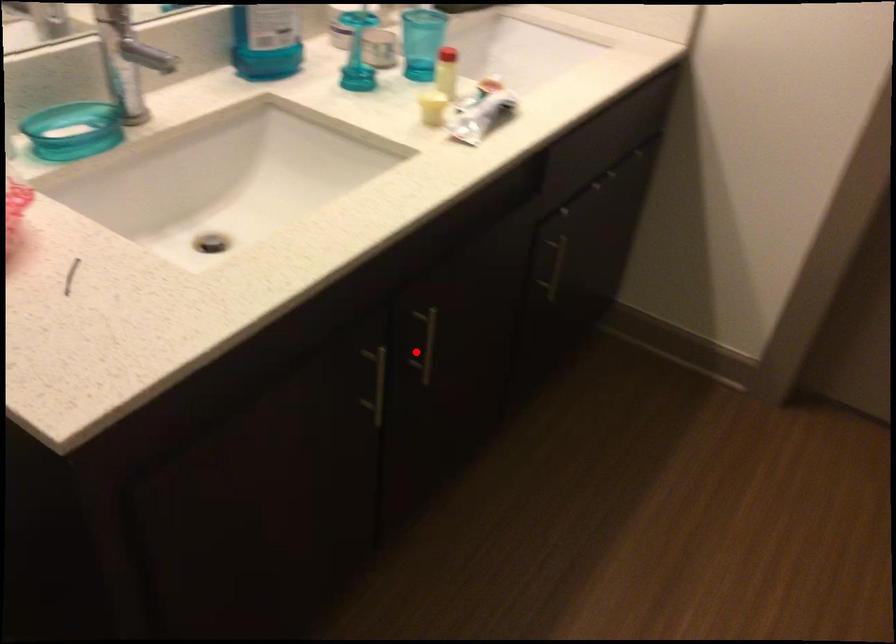
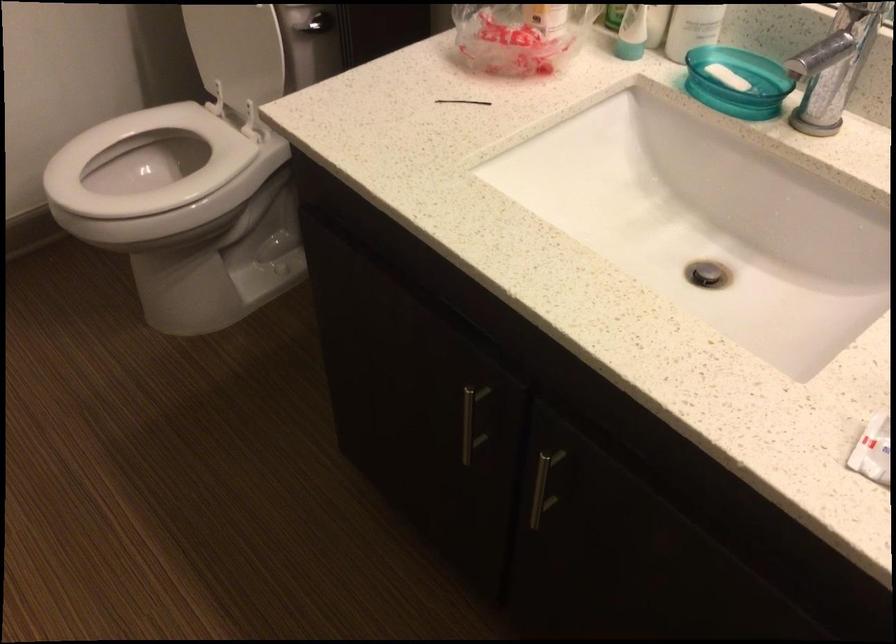
Where in the second image is the point corresponding to the highlighted location from the first image?

(543, 486)